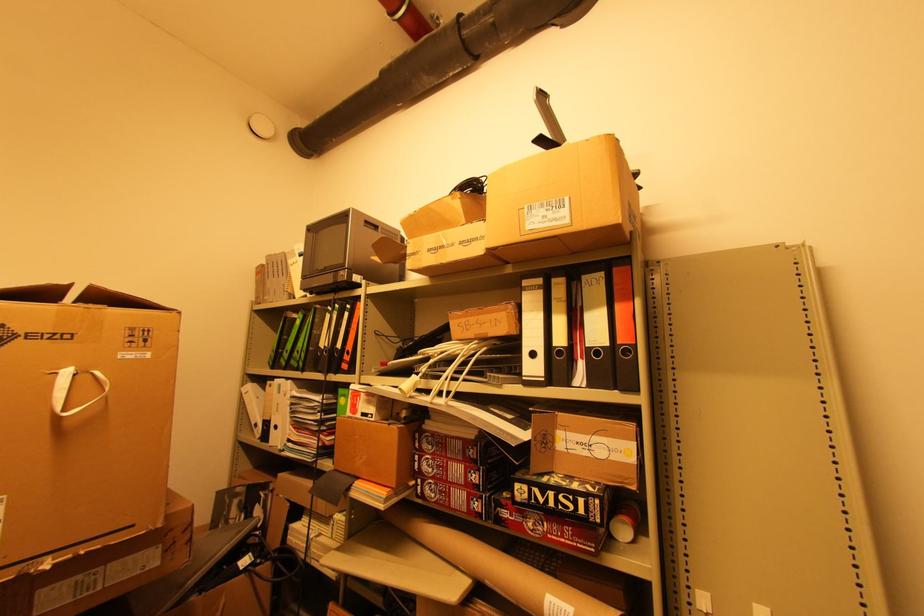
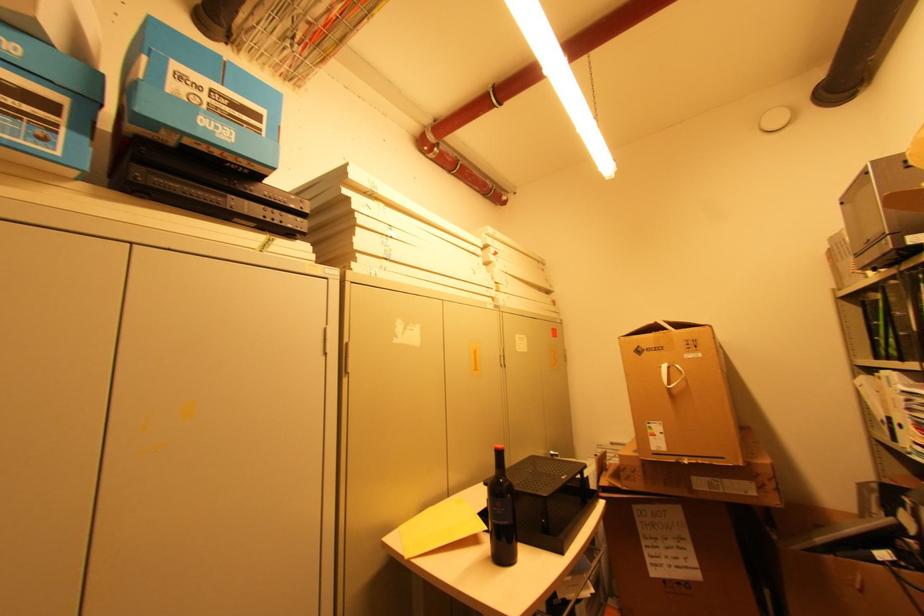
Question: I am providing you with two images of the same scene from different viewpoints. Please identify which objects are invisible in image2.

Choices:
 (A) dark glass bottle
 (B) black electronic device
 (C) black binder
 (D) none of these

Answer: (D)